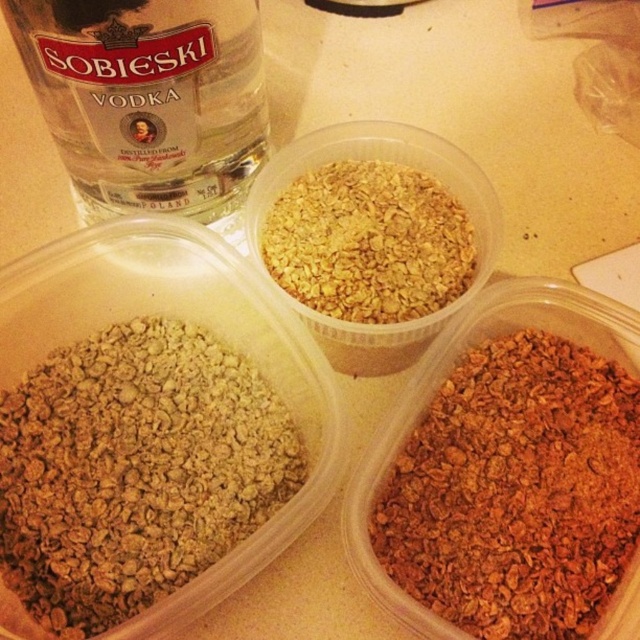
You are a nutritionist trying to arrange these containers for a presentation. You need to place the wider container on the left side of the display. Based on the image, which container should you choose between the brown granular cereal at lower left and the golden granular cereal at center?

The brown granular cereal at lower left might be wider than the golden granular cereal at center, so you should choose the brown granular cereal at lower left to place on the left side of the display.

You are organizing a pantry and see the brown crunchy granola at lower right and the matte glass bottle at upper left. Which object is located lower in the image?

The brown crunchy granola at lower right is positioned under the matte glass bottle at upper left, so it is lower in the image.

You are standing in front of the three containers on the countertop. You want to reach the point at coordinate point [90,349]. However, there is an obstacle at point point [323,314]. Can you reach the first point without moving around the obstacle?

Point [90,349] is behind point [323,314], so you cannot reach it without moving around the obstacle at point [323,314].